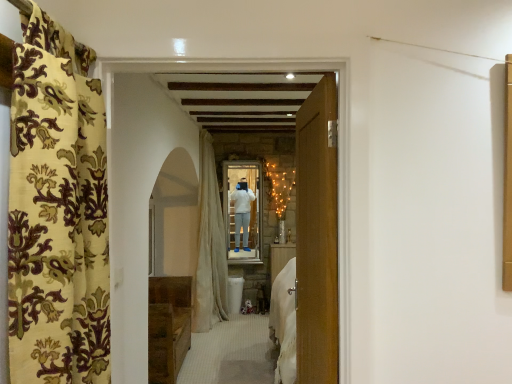
Question: Is velvet floral curtain at left, the second curtain viewed from the back, further to camera compared to wooden door at center?

Choices:
 (A) yes
 (B) no

Answer: (B)

Question: Is velvet floral curtain at left, the second curtain viewed from the back, positioned with its back to wooden door at center?

Choices:
 (A) no
 (B) yes

Answer: (A)

Question: From the image's perspective, is velvet floral curtain at left, the second curtain viewed from the back, on wooden door at center?

Choices:
 (A) yes
 (B) no

Answer: (B)

Question: Is wooden door at center located within velvet floral curtain at left, the second curtain viewed from the back?

Choices:
 (A) yes
 (B) no

Answer: (B)

Question: Is velvet floral curtain at left, which ranks as the 1th curtain in front-to-back order, shorter than wooden door at center?

Choices:
 (A) yes
 (B) no

Answer: (A)

Question: Considering the positions of white sheer curtain at center, marked as the second curtain in a front-to-back arrangement, and velvet floral curtain at left, the second curtain viewed from the back, in the image, is white sheer curtain at center, marked as the second curtain in a front-to-back arrangement, taller or shorter than velvet floral curtain at left, the second curtain viewed from the back,?

Choices:
 (A) tall
 (B) short

Answer: (A)

Question: Looking at the image, does white sheer curtain at center, marked as the second curtain in a front-to-back arrangement, seem bigger or smaller compared to velvet floral curtain at left, which ranks as the 1th curtain in front-to-back order?

Choices:
 (A) small
 (B) big

Answer: (B)

Question: In terms of width, does white sheer curtain at center, marked as the second curtain in a front-to-back arrangement, look wider or thinner when compared to velvet floral curtain at left, the second curtain viewed from the back?

Choices:
 (A) wide
 (B) thin

Answer: (A)

Question: Relative to velvet floral curtain at left, which ranks as the 1th curtain in front-to-back order, is white sheer curtain at center, the first curtain in the back-to-front sequence, in front or behind?

Choices:
 (A) front
 (B) behind

Answer: (B)

Question: From their relative heights in the image, would you say white sheer curtain at center, marked as the second curtain in a front-to-back arrangement, is taller or shorter than brown wooden chest at lower left?

Choices:
 (A) short
 (B) tall

Answer: (B)

Question: From the image's perspective, is white sheer curtain at center, marked as the second curtain in a front-to-back arrangement, located above or below brown wooden chest at lower left?

Choices:
 (A) below
 (B) above

Answer: (B)

Question: Is white sheer curtain at center, marked as the second curtain in a front-to-back arrangement, to the left or to the right of brown wooden chest at lower left in the image?

Choices:
 (A) left
 (B) right

Answer: (B)

Question: From a real-world perspective, relative to brown wooden chest at lower left, is white sheer curtain at center, marked as the second curtain in a front-to-back arrangement, vertically above or below?

Choices:
 (A) above
 (B) below

Answer: (A)

Question: Looking at their shapes, would you say wooden door at center is wider or thinner than velvet floral curtain at left, which ranks as the 1th curtain in front-to-back order?

Choices:
 (A) thin
 (B) wide

Answer: (A)

Question: Is wooden door at center to the left or to the right of velvet floral curtain at left, which ranks as the 1th curtain in front-to-back order, in the image?

Choices:
 (A) left
 (B) right

Answer: (B)